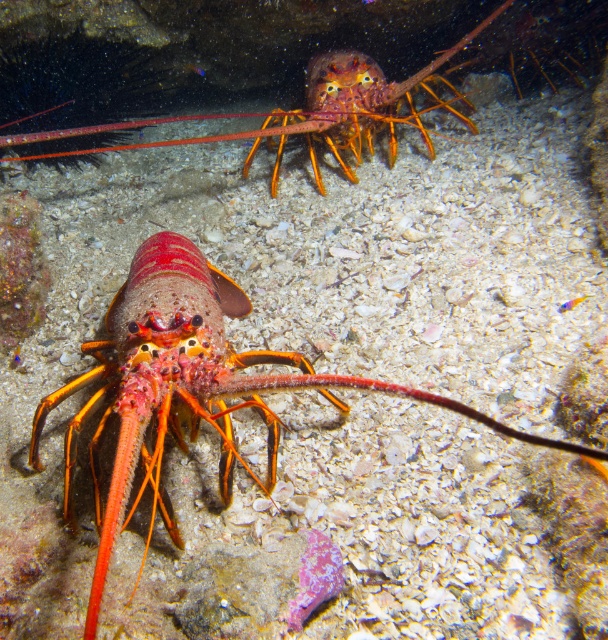
Between shiny orange lobster at center and shiny orange lobster at upper center, which one has less height?

Standing shorter between the two is shiny orange lobster at center.

Measure the distance between point (250, 358) and camera.

Point (250, 358) and camera are 1.55 meters apart from each other.

Image resolution: width=608 pixels, height=640 pixels. What are the coordinates of `shiny orange lobster at center` in the screenshot? It's located at (185, 380).